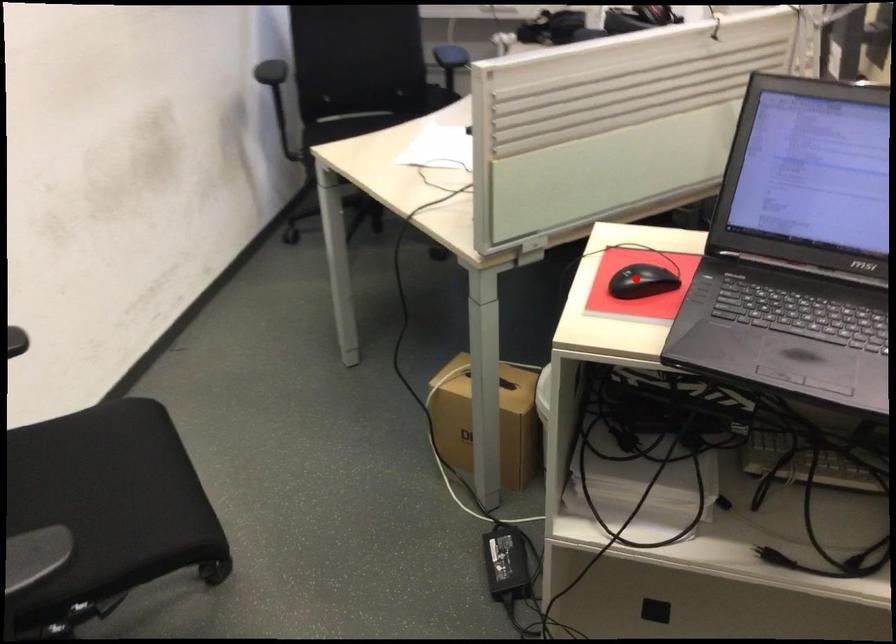
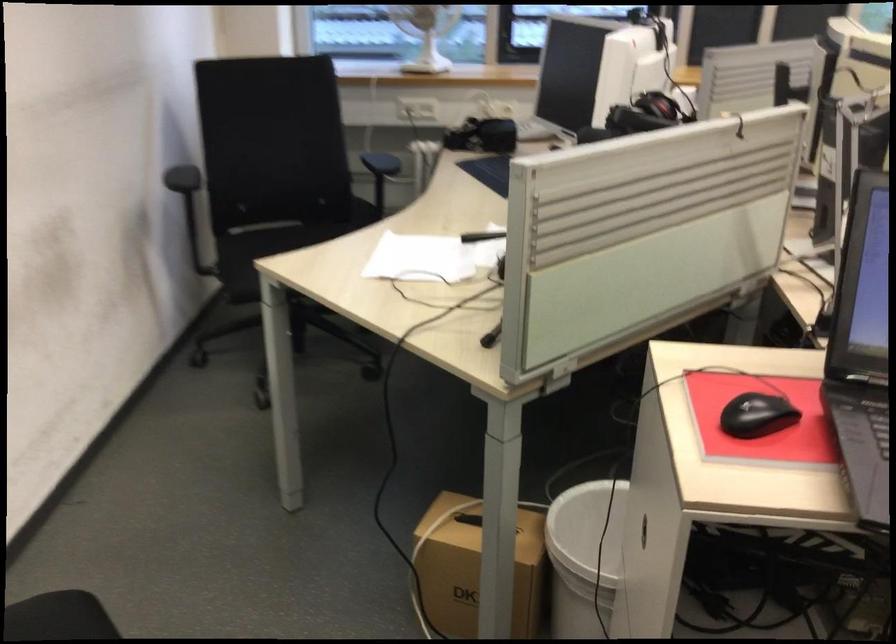
The point at the highlighted location is marked in the first image. Where is the corresponding point in the second image?

(756, 415)